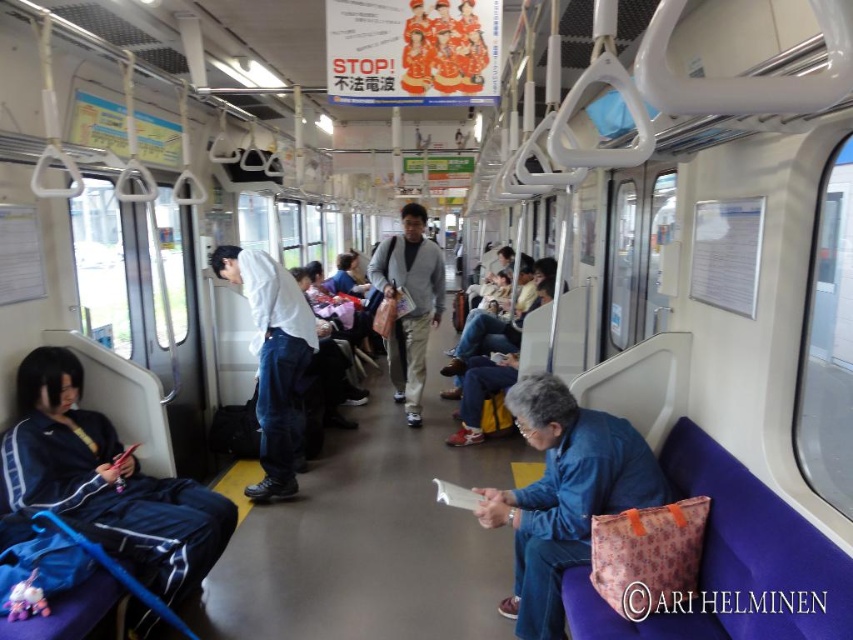
Question: Can you confirm if dark blue track suit at left is wider than denim pants at center?

Choices:
 (A) no
 (B) yes

Answer: (B)

Question: Which object appears farthest from the camera in this image?

Choices:
 (A) denim pants at center
 (B) dark blue track suit at left
 (C) matte gray sweater at center

Answer: (C)

Question: Can you confirm if denim pants at center is positioned to the left of matte gray sweater at center?

Choices:
 (A) yes
 (B) no

Answer: (A)

Question: Based on their relative distances, which object is nearer to the blue fabric bag at lower right?

Choices:
 (A) matte gray sweater at center
 (B) denim pants at center
 (C) dark blue track suit at left

Answer: (C)

Question: In this image, where is dark blue track suit at left located relative to matte gray sweater at center?

Choices:
 (A) left
 (B) right

Answer: (A)

Question: Which point is closer to the camera taking this photo?

Choices:
 (A) (265, 444)
 (B) (404, 368)
 (C) (215, 499)

Answer: (C)